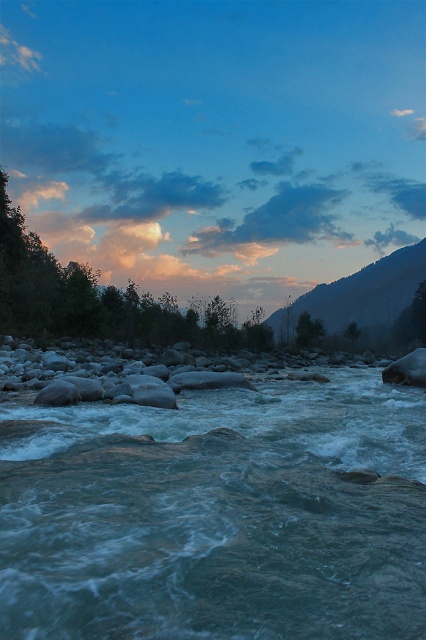
Question: Is translucent blue water at center below rocky mountain at upper right?

Choices:
 (A) no
 (B) yes

Answer: (B)

Question: Where is translucent blue water at center located in relation to rocky mountain at upper right in the image?

Choices:
 (A) below
 (B) above

Answer: (A)

Question: Does translucent blue water at center have a smaller size compared to rocky mountain at upper right?

Choices:
 (A) no
 (B) yes

Answer: (B)

Question: Which point is closer to the camera taking this photo?

Choices:
 (A) pyautogui.click(x=104, y=534)
 (B) pyautogui.click(x=388, y=284)

Answer: (A)

Question: Which point is closer to the camera taking this photo?

Choices:
 (A) (379, 404)
 (B) (417, 250)

Answer: (A)